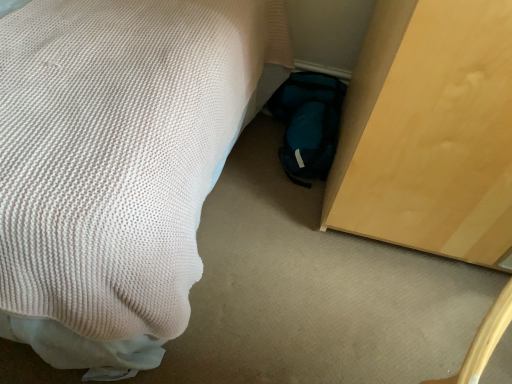
Locate an element on the screen. The height and width of the screenshot is (384, 512). vacant region above teal fabric bag at lower center (from a real-world perspective) is located at coordinates (310, 122).